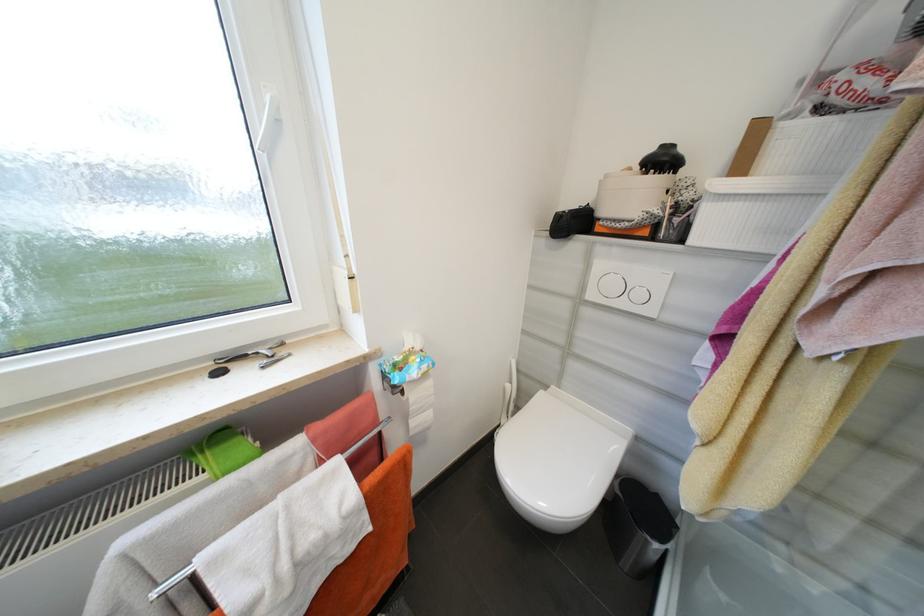
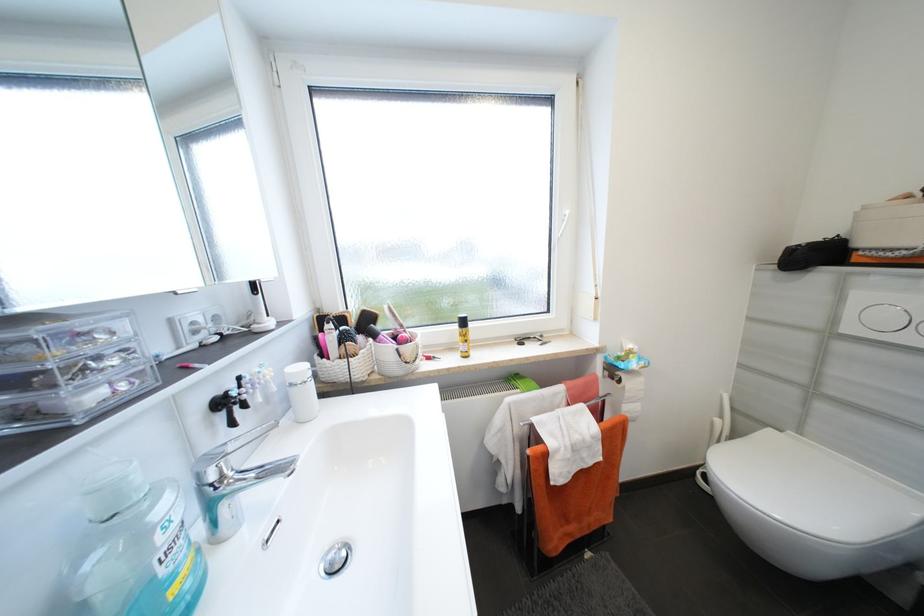
Question: The camera is either moving clockwise (left) or counter-clockwise (right) around the object. The first image is from the beginning of the video and the second image is from the end. Is the camera moving left or right when shooting the video?

Choices:
 (A) Left
 (B) Right

Answer: (B)